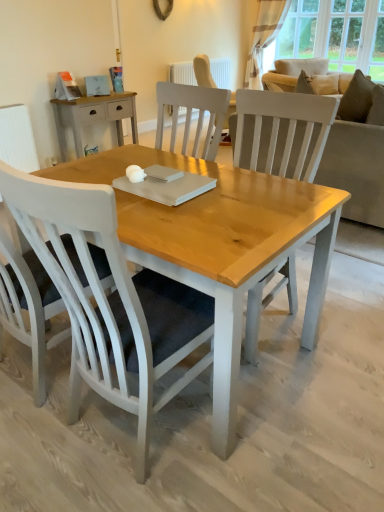
Question: From a real-world perspective, is white painted radiator at upper center physically located above or below light beige fabric couch at upper right?

Choices:
 (A) above
 (B) below

Answer: (B)

Question: Would you say white painted radiator at upper center is to the left or to the right of light beige fabric couch at upper right in the picture?

Choices:
 (A) right
 (B) left

Answer: (B)

Question: Estimate the real-world distances between objects in this image. Which object is closer to the suede-like beige pillow at upper right?

Choices:
 (A) light brown wood desk at upper left
 (B) white painted radiator at upper center
 (C) striped fabric curtain at upper right
 (D) light beige fabric couch at upper right
 (E) white painted wood chair at left, the 1th chair viewed from the left

Answer: (D)

Question: Which object is positioned closest to the light beige fabric couch at upper right?

Choices:
 (A) white painted wood chair at center, marked as the 2th chair in a left-to-right arrangement
 (B) white painted wood chair at left, arranged as the 2th chair when viewed from the right
 (C) suede-like beige pillow at upper right
 (D) light brown wood desk at upper left
 (E) striped fabric curtain at upper right

Answer: (C)